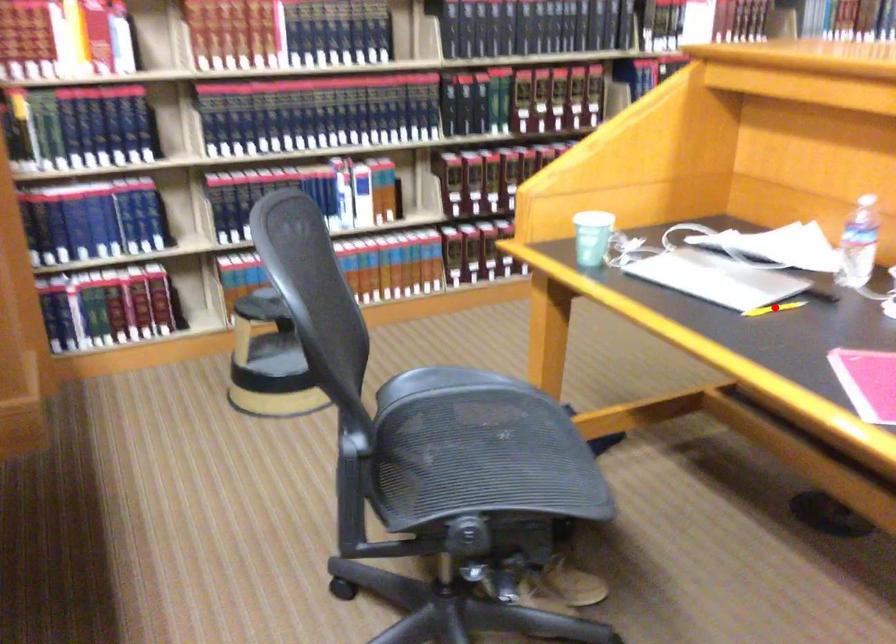
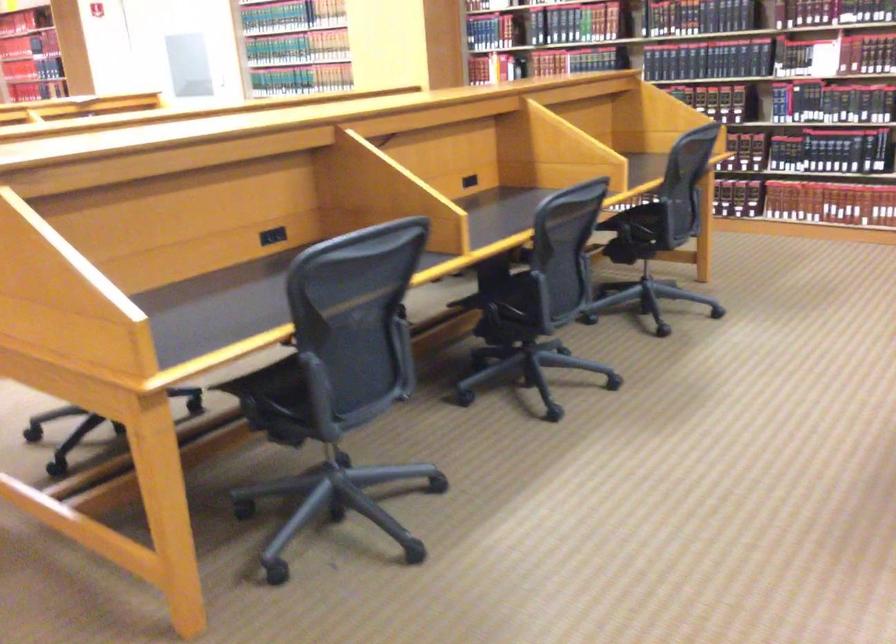
Question: I am providing you with two images of the same scene from different viewpoints. A red point is marked on the first image. Can you still see the location of the red point in image 2?

Choices:
 (A) Yes
 (B) No

Answer: (B)